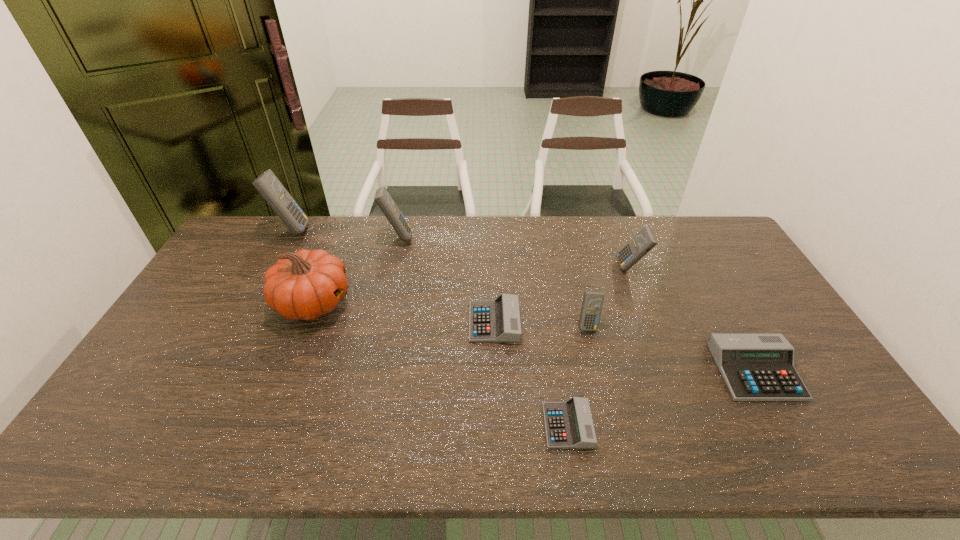
I want to click on free region located on the front-facing side of the fifth shortest object, so click(569, 267).

At what (x,y) coordinates should I click in order to perform the action: click on vacant space located 0.140m on the front-facing side of the fifth shortest object. Please return your answer as a coordinate pair (x, y). The width and height of the screenshot is (960, 540). Looking at the image, I should click on (576, 267).

Image resolution: width=960 pixels, height=540 pixels. Identify the location of vacant space located on the front-facing side of the fifth tallest object. (619, 454).

Locate an element on the screen. This screenshot has height=540, width=960. vacant area situated on the back of the sixth farthest calculator is located at coordinates pyautogui.click(x=721, y=310).

At what (x,y) coordinates should I click in order to perform the action: click on vacant space located 0.150m on the right of the seventh tallest object. Please return your answer as a coordinate pair (x, y). This screenshot has width=960, height=540. Looking at the image, I should click on (569, 322).

Find the location of a particular element. vacant space located on the right of the second gray calculator from left to right is located at coordinates (756, 426).

I want to click on object located at the near edge, so click(x=569, y=424).

At what (x,y) coordinates should I click in order to perform the action: click on object situated at the left edge. Please return your answer as a coordinate pair (x, y). Looking at the image, I should click on (267, 184).

Where is `object positioned at the right edge`? object positioned at the right edge is located at coordinates (755, 367).

This screenshot has height=540, width=960. Find the location of `object at the far left corner`. object at the far left corner is located at coordinates (267, 184).